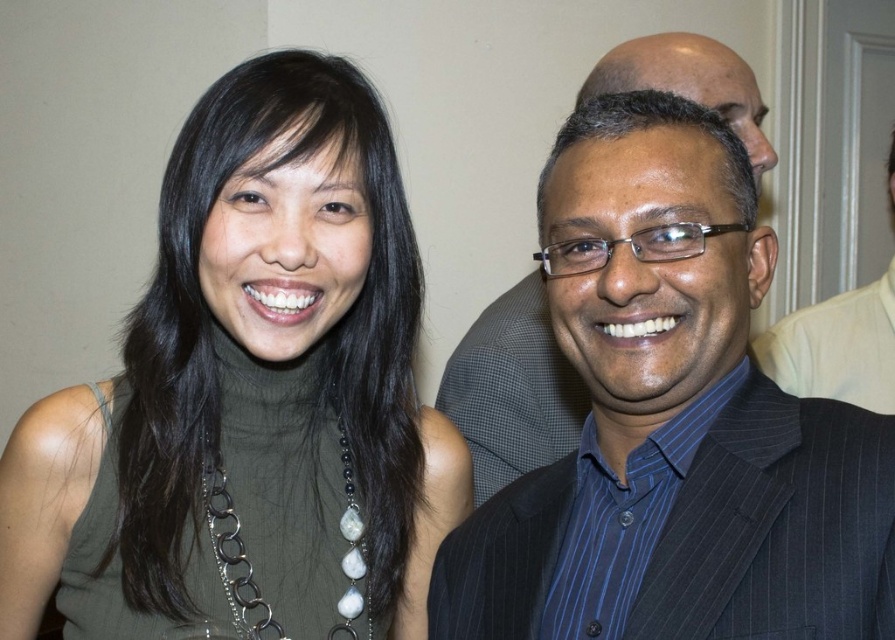
You are standing in front of the two people in the image and want to take a photo of them. If you are exactly at the point marked as point (491,444), will you be able to capture both people in the frame without moving your camera? Explain your reasoning based on the distance from the camera to that point.

The distance from the camera to point (491,444) is 1.42 meters. Since both individuals are positioned at that point, you would be able to capture them in the frame as they are at the same distance from the camera.

From the picture: You are a photographer setting up for a group photo. You have two suits in the scene, the black pinstripe suit at center and the matte black suit at right. Which suit should you focus on if you want to capture the larger one in your frame?

The black pinstripe suit at center has a larger size compared to the matte black suit at right, so you should focus on the black pinstripe suit at center to capture the larger one in your frame.

In the scene shown: You are standing at the point marked as point (794, 394) in the image. You want to take a photo of the two people in the scene. Can you fit both of them in your camera frame without moving? Explain your reasoning based on the distance between you and the point.

The distance between you and the point (794, 394) is 1.32 meters. Since the two people are positioned closely together in the image and you are at that point, you can likely fit both of them in your camera frame without needing to move, as the distance is sufficient to capture both subjects in a standard camera view.